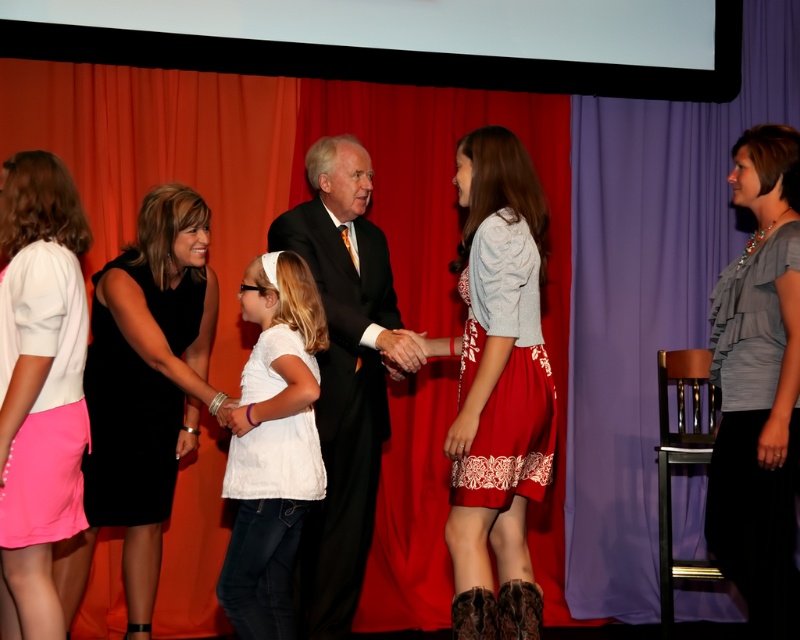
Question: Does black dress at center appear over black suit at center?

Choices:
 (A) no
 (B) yes

Answer: (A)

Question: Can you confirm if black dress at center is wider than gray satin blouse at right?

Choices:
 (A) yes
 (B) no

Answer: (A)

Question: Which point appears closest to the camera in this image?

Choices:
 (A) (324, 330)
 (B) (784, 627)
 (C) (306, 602)
 (D) (120, 262)

Answer: (B)

Question: Estimate the real-world distances between objects in this image. Which object is farther from the red lace dress at center?

Choices:
 (A) pink fabric skirt at lower left
 (B) white cotton shirt at center
 (C) gray satin blouse at right
 (D) black dress at center

Answer: (A)

Question: Can you confirm if white cotton shirt at center is bigger than pink fabric skirt at lower left?

Choices:
 (A) no
 (B) yes

Answer: (B)

Question: Which point appears farthest from the camera in this image?

Choices:
 (A) (378, 412)
 (B) (76, 554)

Answer: (A)